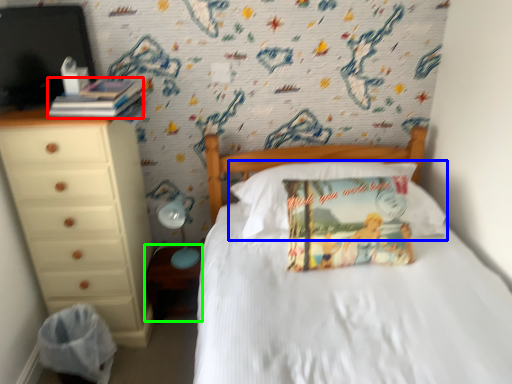
Question: Considering the real-world distances, which object is farthest from book (highlighted by a red box)? pillow (highlighted by a blue box) or nightstand (highlighted by a green box)?

Choices:
 (A) pillow
 (B) nightstand

Answer: (B)